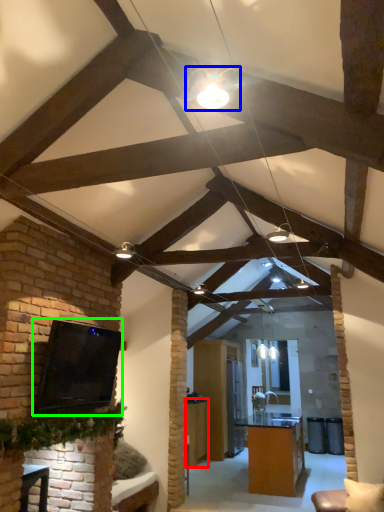
Question: Which object is the closest to the table (highlighted by a red box)? Choose among these: light fixture (highlighted by a blue box) or open (highlighted by a green box).

Choices:
 (A) light fixture
 (B) open

Answer: (B)